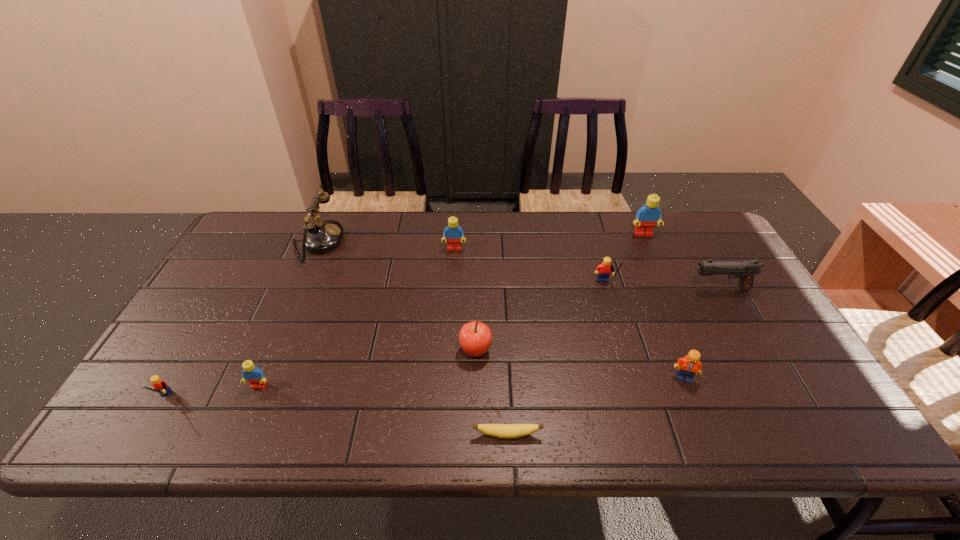
Where is `unoccupied area between the biggest blue Lego and the gun`? This screenshot has width=960, height=540. unoccupied area between the biggest blue Lego and the gun is located at coordinates (682, 261).

Identify the location of free space between the nearer yellow Lego and the right yellow Lego. (384, 342).

Find the location of a particular element. vacant area that lies between the leftmost object and the gray gun is located at coordinates (442, 345).

This screenshot has width=960, height=540. In order to click on vacant space in between the tallest Lego and the telephone in this screenshot , I will do `click(480, 238)`.

In order to click on free space between the telephone and the left yellow Lego in this screenshot , I will do `click(240, 321)`.

Identify the location of free space that is in between the nearest object and the nearer yellow Lego. Image resolution: width=960 pixels, height=540 pixels. (335, 417).

The image size is (960, 540). I want to click on vacant space that's between the smallest blue Lego and the fifth nearest object, so click(368, 368).

Point out which object is positioned as the second nearest to the apple. Please provide its 2D coordinates. Your answer should be formatted as a tuple, i.e. [(x, y)], where the tuple contains the x and y coordinates of a point satisfying the conditions above.

[(603, 270)]

Where is `the second closest object to the nearer yellow Lego`? The width and height of the screenshot is (960, 540). the second closest object to the nearer yellow Lego is located at coordinates (323, 236).

Where is `Lego identified as the fourth closest to the biggest blue Lego`? This screenshot has height=540, width=960. Lego identified as the fourth closest to the biggest blue Lego is located at coordinates (251, 373).